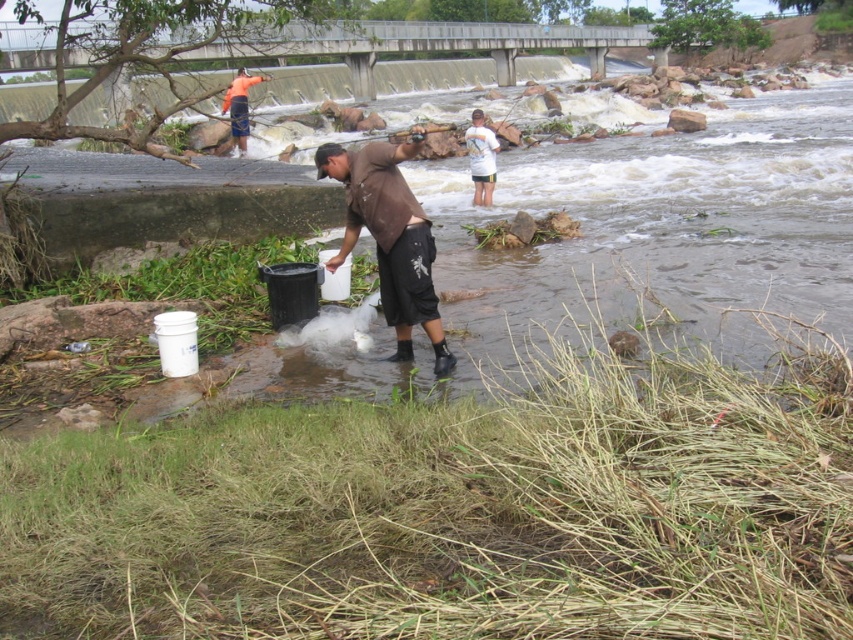
Is brown matte shirt at center wider than white cotton shirt at upper center?

Yes, brown matte shirt at center is wider than white cotton shirt at upper center.

Locate an element on the screen. The image size is (853, 640). brown matte shirt at center is located at coordinates (390, 237).

Identify the location of brown matte shirt at center. The width and height of the screenshot is (853, 640). (390, 237).

Where is `brown matte shirt at center`? brown matte shirt at center is located at coordinates (390, 237).

Is brown matte shirt at center taller than orange fabric shirt at upper left?

Incorrect, brown matte shirt at center's height is not larger of orange fabric shirt at upper left's.

Identify the location of brown matte shirt at center. (x=390, y=237).

Does white cotton shirt at upper center have a greater height compared to orange fabric shirt at upper left?

No.

Does white cotton shirt at upper center have a smaller size compared to orange fabric shirt at upper left?

Indeed, white cotton shirt at upper center has a smaller size compared to orange fabric shirt at upper left.

Is point (469, 157) farther from camera compared to point (229, 84)?

No, (469, 157) is closer to viewer.

Locate an element on the screen. This screenshot has height=640, width=853. white cotton shirt at upper center is located at coordinates (480, 157).